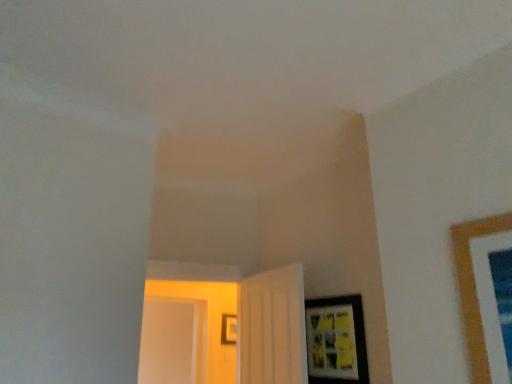
Question: Does matte black picture frame at lower right, the second picture frame positioned from the back, have a smaller size compared to white matte door at center, the second door in the left-to-right sequence?

Choices:
 (A) no
 (B) yes

Answer: (B)

Question: Is matte black picture frame at lower right, the 2th picture frame viewed from the left, positioned behind white matte door at center, the second door in the left-to-right sequence?

Choices:
 (A) no
 (B) yes

Answer: (A)

Question: Considering the relative positions of matte black picture frame at lower right, the first picture frame positioned from the right, and white matte door at center, the first door from the right, in the image provided, is matte black picture frame at lower right, the first picture frame positioned from the right, to the left of white matte door at center, the first door from the right, from the viewer's perspective?

Choices:
 (A) no
 (B) yes

Answer: (A)

Question: From the image's perspective, is matte black picture frame at lower right, placed as the 1th picture frame when sorted from front to back, under white matte door at center, the second door in the left-to-right sequence?

Choices:
 (A) yes
 (B) no

Answer: (A)

Question: Does matte black picture frame at lower right, placed as the 1th picture frame when sorted from front to back, turn towards white matte door at center, the first door from the right?

Choices:
 (A) yes
 (B) no

Answer: (B)

Question: Is white glossy door at center, which ranks as the 2th door in right-to-left order, taller or shorter than matte black picture frame at lower right, placed as the 1th picture frame when sorted from front to back?

Choices:
 (A) short
 (B) tall

Answer: (B)

Question: Is white glossy door at center, which ranks as the 2th door in right-to-left order, situated inside matte black picture frame at lower right, placed as the 1th picture frame when sorted from front to back, or outside?

Choices:
 (A) inside
 (B) outside

Answer: (B)

Question: Based on their positions, is white glossy door at center, which ranks as the 2th door in right-to-left order, located to the left or right of matte black picture frame at lower right, which is the 2th picture frame from bottom to top?

Choices:
 (A) right
 (B) left

Answer: (B)

Question: Is point (272, 321) closer or farther from the camera than point (323, 379)?

Choices:
 (A) closer
 (B) farther

Answer: (B)

Question: In terms of width, does white matte door at center, the first door from the right, look wider or thinner when compared to transparent glass door at left?

Choices:
 (A) wide
 (B) thin

Answer: (B)

Question: Is white matte door at center, the first door from the right, bigger or smaller than transparent glass door at left?

Choices:
 (A) small
 (B) big

Answer: (A)

Question: Is white matte door at center, the first door from the right, taller or shorter than transparent glass door at left?

Choices:
 (A) short
 (B) tall

Answer: (A)

Question: In the image, is white matte door at center, the second door in the left-to-right sequence, on the left side or the right side of transparent glass door at left?

Choices:
 (A) right
 (B) left

Answer: (A)

Question: In terms of height, does matte black picture frame at center, acting as the second picture frame starting from the right, look taller or shorter compared to white glossy door at center, which ranks as the 2th door in right-to-left order?

Choices:
 (A) short
 (B) tall

Answer: (A)

Question: From the image's perspective, is matte black picture frame at center, arranged as the 1th picture frame when ordered from the bottom, above or below white glossy door at center, which ranks as the 2th door in right-to-left order?

Choices:
 (A) above
 (B) below

Answer: (B)